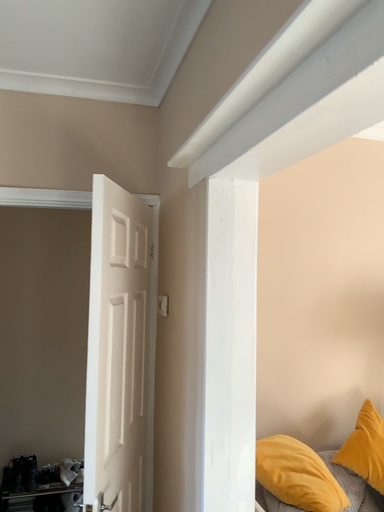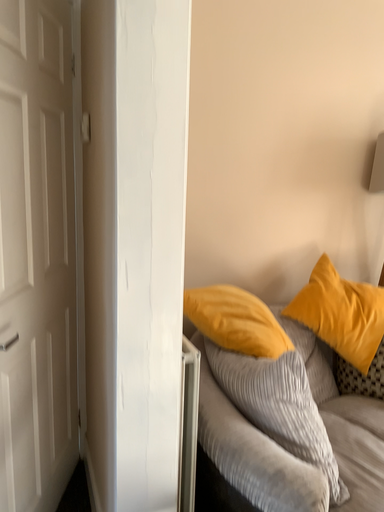
Question: Which way did the camera rotate in the video?

Choices:
 (A) rotated downward
 (B) rotated upward

Answer: (A)